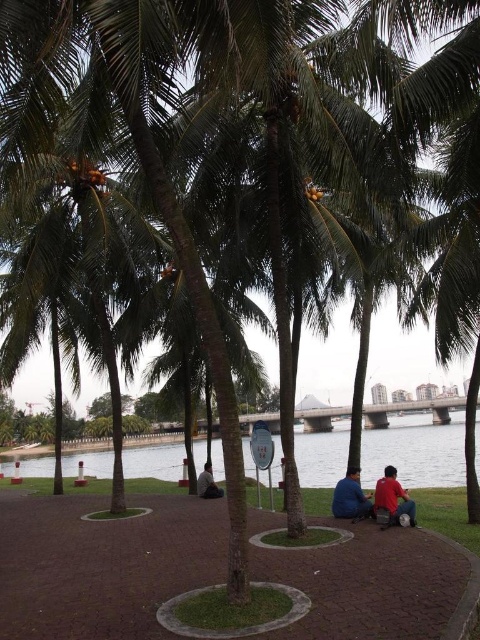
You are a photographer positioned at the riverside. You see the matte red shirt at center and the blue fabric pants at lower center in your viewfinder. Which object should you adjust your camera to focus on first if you want to capture both in a single frame without moving the camera?

You should focus on the blue fabric pants at lower center first because it is positioned to the left of the matte red shirt at center, allowing the camera to naturally include both in the frame by centering on the leftmost object.

You are a photographer standing at the riverside. You notice the matte red shirt at center and the blue fabric pants at lower center in your frame. Which object would appear larger in your camera viewfinder?

The blue fabric pants at lower center would appear larger in the camera viewfinder since it is stated that the matte red shirt at center is smaller than the blue fabric pants at lower center.